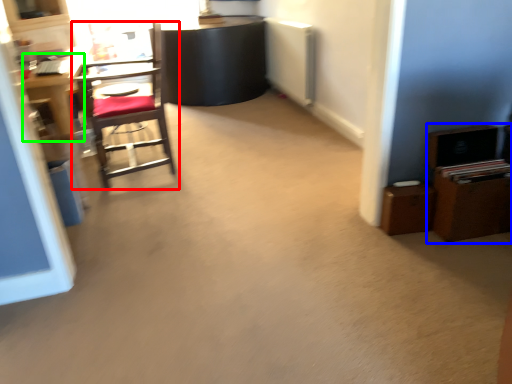
Question: Which is farther away from chair (highlighted by a red box)? dresser (highlighted by a blue box) or desk (highlighted by a green box)?

Choices:
 (A) dresser
 (B) desk

Answer: (A)